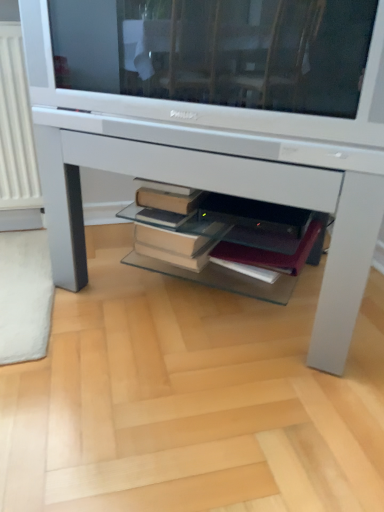
Question: Is maroon leather notebook at center looking in the opposite direction of white glossy desk at center?

Choices:
 (A) yes
 (B) no

Answer: (A)

Question: Is maroon leather notebook at center thinner than white glossy desk at center?

Choices:
 (A) no
 (B) yes

Answer: (B)

Question: Is maroon leather notebook at center at the right side of white glossy desk at center?

Choices:
 (A) yes
 (B) no

Answer: (A)

Question: From the image's perspective, is maroon leather notebook at center below white glossy desk at center?

Choices:
 (A) no
 (B) yes

Answer: (B)

Question: From a real-world perspective, is maroon leather notebook at center positioned over white glossy desk at center based on gravity?

Choices:
 (A) yes
 (B) no

Answer: (B)

Question: Could you tell me if maroon leather notebook at center is facing white glossy desk at center?

Choices:
 (A) yes
 (B) no

Answer: (A)

Question: Is maroon leather notebook at center to the left of white glossy television at upper center from the viewer's perspective?

Choices:
 (A) no
 (B) yes

Answer: (A)

Question: From the image's perspective, is maroon leather notebook at center below white glossy television at upper center?

Choices:
 (A) no
 (B) yes

Answer: (B)

Question: Is white glossy television at upper center at the back of maroon leather notebook at center?

Choices:
 (A) yes
 (B) no

Answer: (B)

Question: From the image's perspective, is maroon leather notebook at center over white glossy television at upper center?

Choices:
 (A) yes
 (B) no

Answer: (B)

Question: From a real-world perspective, is maroon leather notebook at center beneath white glossy television at upper center?

Choices:
 (A) yes
 (B) no

Answer: (A)

Question: From a real-world perspective, is maroon leather notebook at center physically above white glossy television at upper center?

Choices:
 (A) yes
 (B) no

Answer: (B)

Question: From a real-world perspective, does white glossy television at upper center sit lower than white glossy desk at center?

Choices:
 (A) no
 (B) yes

Answer: (A)